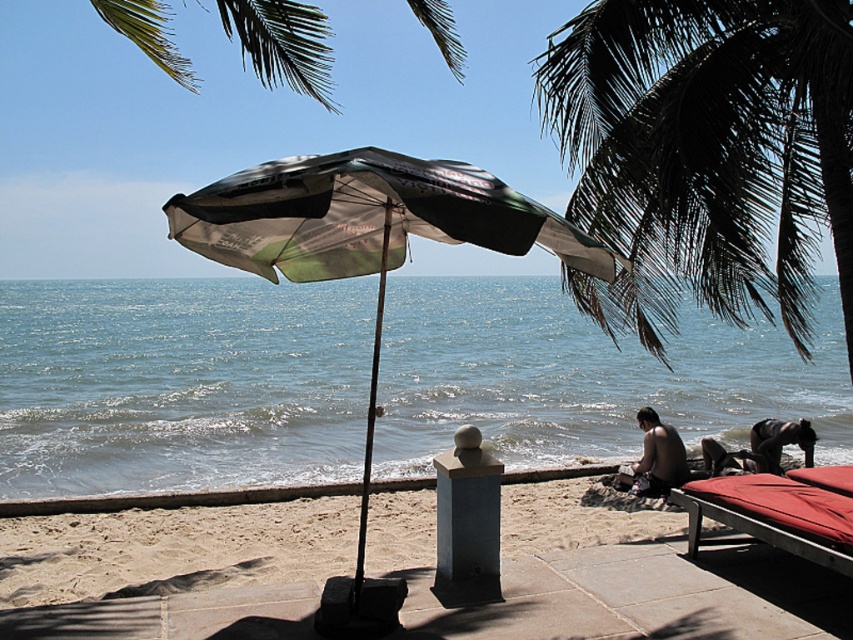
Question: Where is dark green leafy palm tree at upper right located in relation to skinny man at lower right in the image?

Choices:
 (A) left
 (B) right

Answer: (A)

Question: Is matte black umbrella at center positioned at the back of skinny man at lower right?

Choices:
 (A) yes
 (B) no

Answer: (B)

Question: Which object is closer to the camera taking this photo?

Choices:
 (A) dark green leafy palm tree at upper right
 (B) matte black umbrella at center
 (C) skinny man at lower right
 (D) blue water at center

Answer: (B)

Question: Estimate the real-world distances between objects in this image. Which object is closer to the skinny man at lower right?

Choices:
 (A) dark brown leather bag at lower right
 (B) black metal pole at center

Answer: (A)

Question: Can you confirm if matte black umbrella at center is bigger than printed fabric umbrella at center?

Choices:
 (A) yes
 (B) no

Answer: (B)

Question: Which object is farther from the camera taking this photo?

Choices:
 (A) skinny man at lower right
 (B) dark brown leather bag at lower right

Answer: (B)